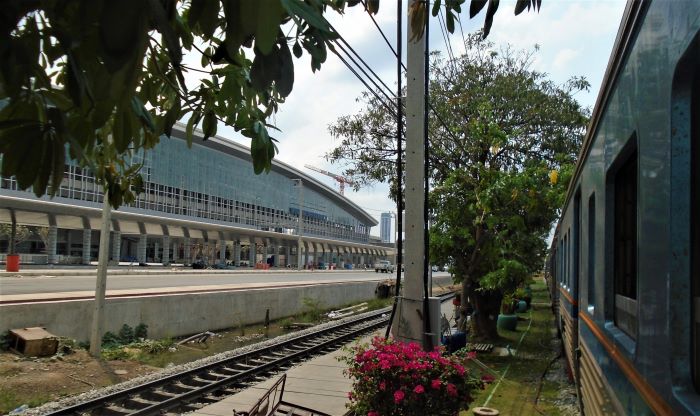
In order to click on window in this screenshot , I will do `click(628, 248)`.